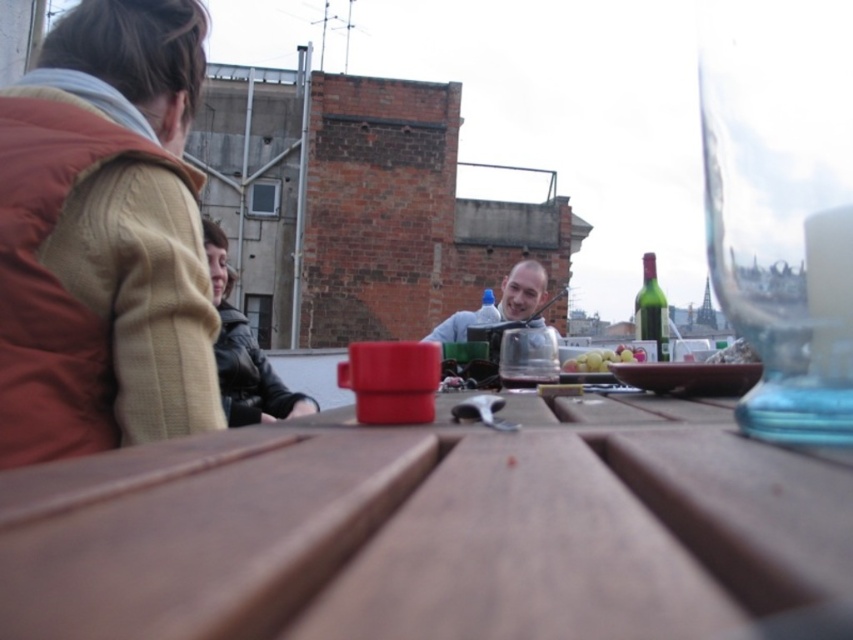
Question: Can you confirm if shiny silver flask at center is positioned to the left of green glass bottle at upper right?

Choices:
 (A) no
 (B) yes

Answer: (B)

Question: Which of the following is the closest to the observer?

Choices:
 (A) green glass bottle at upper right
 (B) black leather jacket at left
 (C) transparent glass wine glass at upper right

Answer: (C)

Question: Considering the real-world distances, which object is farthest from the shiny silver flask at center?

Choices:
 (A) brown quilted vest at left
 (B) wooden picnic table at center

Answer: (B)

Question: Which of the following is the farthest from the observer?

Choices:
 (A) (476, 310)
 (B) (709, 228)
 (C) (604, 364)

Answer: (A)

Question: Does brown quilted vest at left have a greater width compared to transparent glass wine glass at upper right?

Choices:
 (A) yes
 (B) no

Answer: (A)

Question: Is black leather jacket at left above shiny silver flask at center?

Choices:
 (A) yes
 (B) no

Answer: (B)